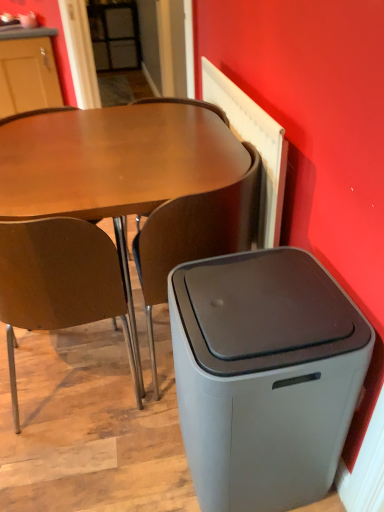
Find the location of a particular element. Image resolution: width=384 pixels, height=512 pixels. blank space situated above matte brown desk at center (from a real-world perspective) is located at coordinates (115, 145).